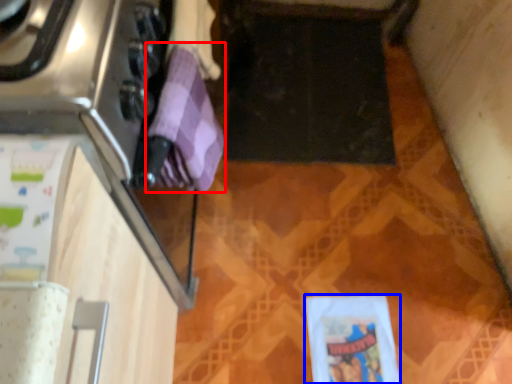
Question: Which point is closer to the camera, wrapping paper (highlighted by a red box) or wrapping paper (highlighted by a blue box)?

Choices:
 (A) wrapping paper
 (B) wrapping paper

Answer: (A)